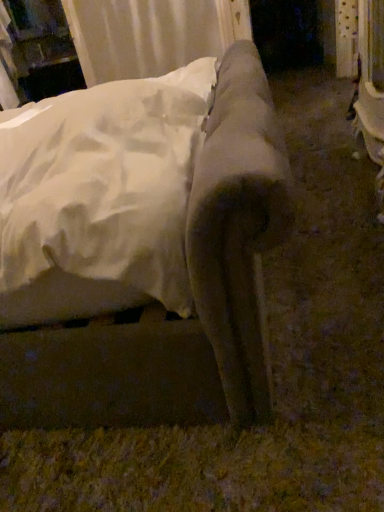
In order to face velvet beige sofa at center, should I rotate leftwards or rightwards?

You should look left and rotate roughly 20.800 degrees.

This screenshot has width=384, height=512. Find the location of `velvet beige sofa at center`. velvet beige sofa at center is located at coordinates (160, 305).

The image size is (384, 512). Describe the element at coordinates (160, 305) in the screenshot. I see `velvet beige sofa at center` at that location.

This screenshot has height=512, width=384. Find the location of `velvet beige sofa at center`. velvet beige sofa at center is located at coordinates (160, 305).